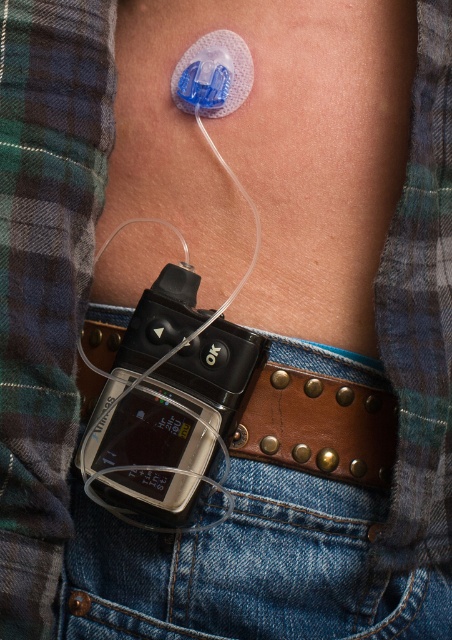
You are a medical professional examining a patient. You notice the brown leather belt at lower center and the denim at lower center. Which object is closer to the front of the patient?

The brown leather belt at lower center is behind the denim at lower center, so the denim at lower center is closer to the front of the patient.